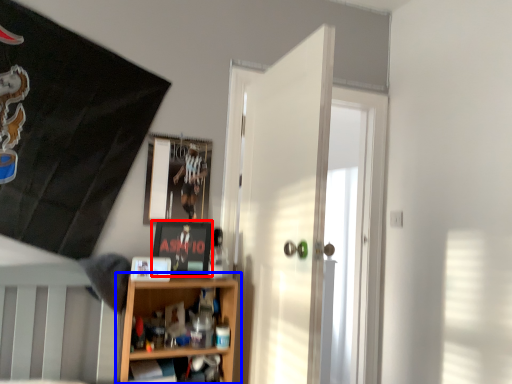
Question: Which object is further to the camera taking this photo, picture frame (highlighted by a red box) or shelf (highlighted by a blue box)?

Choices:
 (A) picture frame
 (B) shelf

Answer: (A)